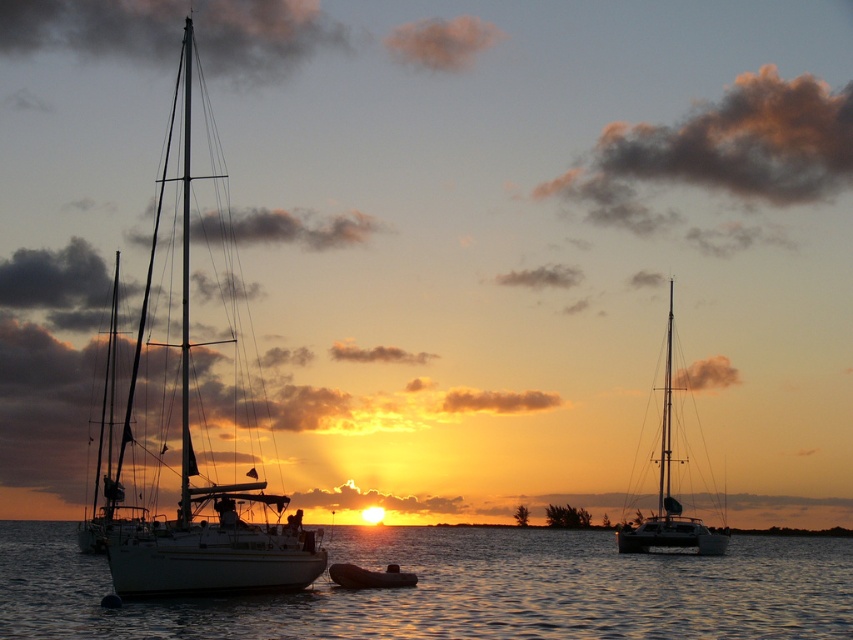
Question: Can you confirm if glistening water at center is bigger than silvery metallic sailboat at center?

Choices:
 (A) yes
 (B) no

Answer: (A)

Question: Which of the following is the closest to the observer?

Choices:
 (A) glistening water at center
 (B) silvery metallic sailboat at center
 (C) white matte sailboat at left
 (D) rubber dinghy at center

Answer: (A)

Question: Does glistening water at center have a smaller size compared to white matte sailboat at left?

Choices:
 (A) yes
 (B) no

Answer: (B)

Question: Estimate the real-world distances between objects in this image. Which object is farther from the white matte sailboat at left?

Choices:
 (A) silvery metallic sailboat at center
 (B) glistening water at center

Answer: (A)

Question: Which point appears closest to the camera in this image?

Choices:
 (A) (378, 552)
 (B) (410, 576)
 (C) (254, 554)
 (D) (619, 547)

Answer: (C)

Question: Can you confirm if silvery metallic sailboat at center is positioned above rubber dinghy at center?

Choices:
 (A) yes
 (B) no

Answer: (B)